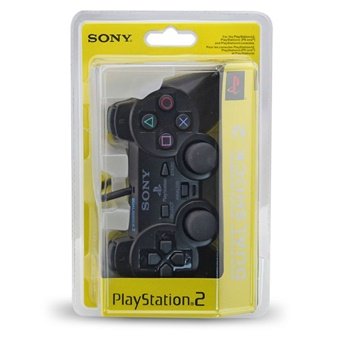
At what (x,y) coordinates should I click in order to perform the action: click on select button looks like a play arrow facing right on the remote. Please return your answer as a coordinate pair (x, y). Looking at the image, I should click on pyautogui.click(x=165, y=169).